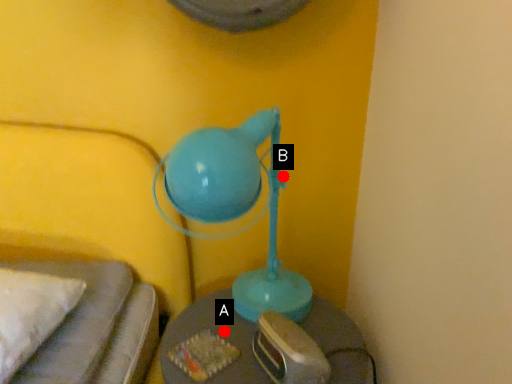
Question: Two points are circled on the image, labeled by A and B beside each circle. Which point is farther to the camera?

Choices:
 (A) A is further
 (B) B is further

Answer: (A)